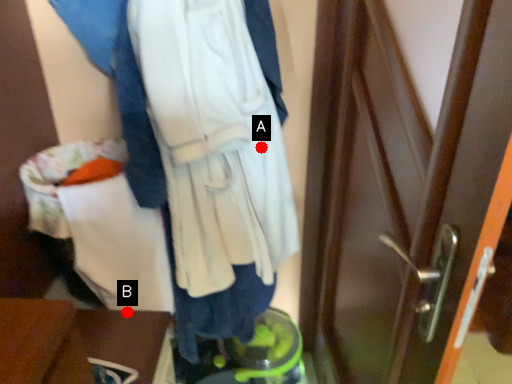
Question: Two points are circled on the image, labeled by A and B beside each circle. Which point is closer to the camera taking this photo?

Choices:
 (A) A is closer
 (B) B is closer

Answer: (B)